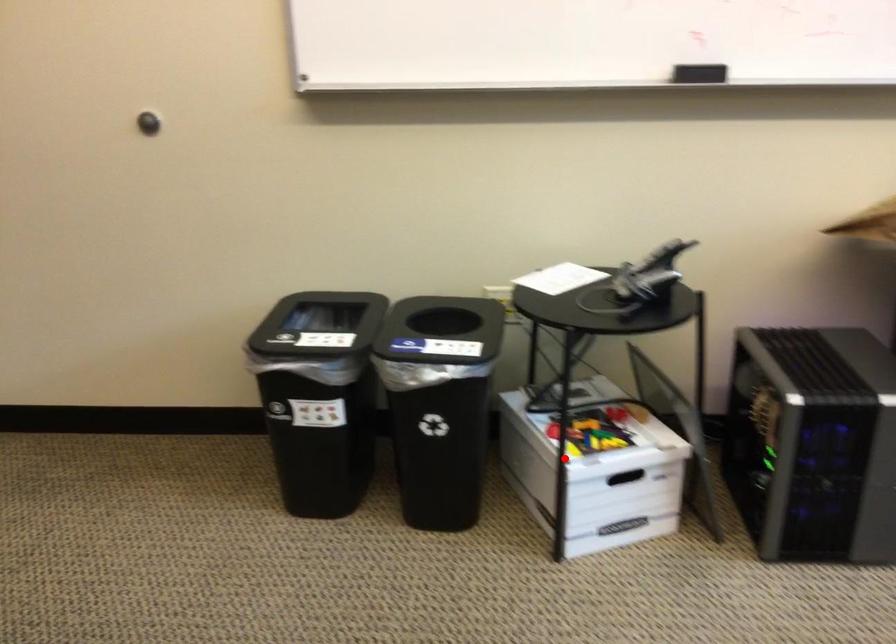
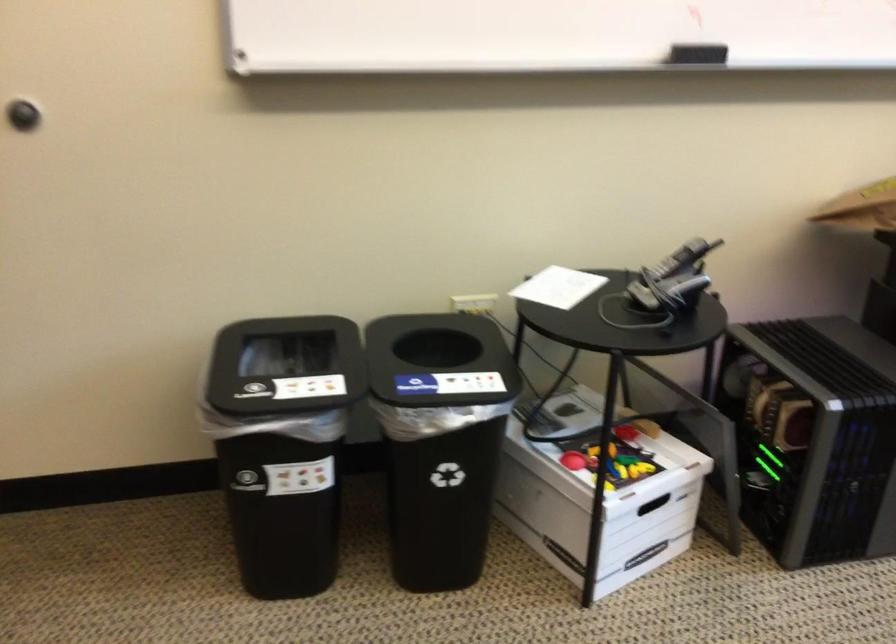
The point at the highlighted location is marked in the first image. Where is the corresponding point in the second image?

(599, 495)